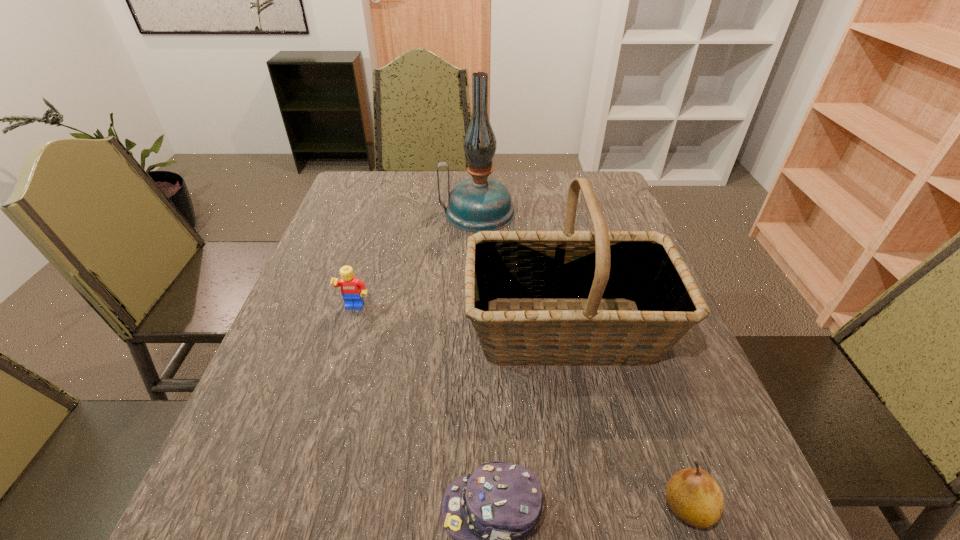
Identify the location of free region located 0.100m on the left of the pear. (599, 508).

I want to click on object situated at the far edge, so click(479, 203).

This screenshot has width=960, height=540. I want to click on object that is positioned at the near edge, so click(x=692, y=495).

This screenshot has height=540, width=960. I want to click on object located at the left edge, so pos(352,289).

Identify the location of basket that is at the right edge. The image size is (960, 540). (641, 269).

Image resolution: width=960 pixels, height=540 pixels. Identify the location of pear that is at the right edge. (692, 495).

Identify the location of object located at the near right corner. The width and height of the screenshot is (960, 540). (692, 495).

The image size is (960, 540). Identify the location of vacant position at the far edge of the desktop. (537, 171).

The height and width of the screenshot is (540, 960). I want to click on vacant space at the near edge of the desktop, so click(663, 524).

You are a GUI agent. You are given a task and a screenshot of the screen. Output one action in this format:
    pyautogui.click(x=<x>, y=<y>)
    Task: Click on the free point at the left edge
    Image resolution: width=960 pixels, height=540 pixels.
    Given the screenshot: What is the action you would take?
    pyautogui.click(x=263, y=438)